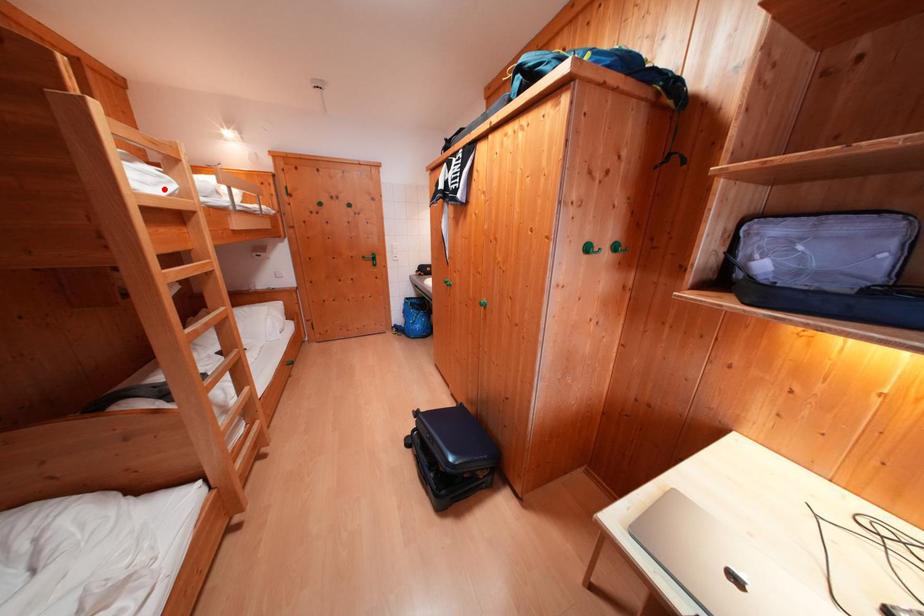
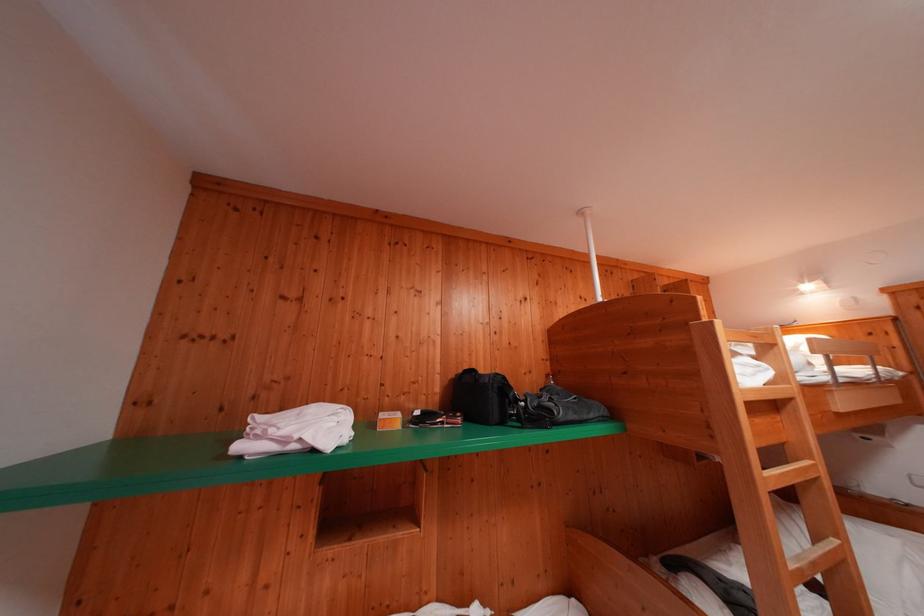
Locate, in the second image, the point that corresponds to the highlighted location in the first image.

(762, 379)